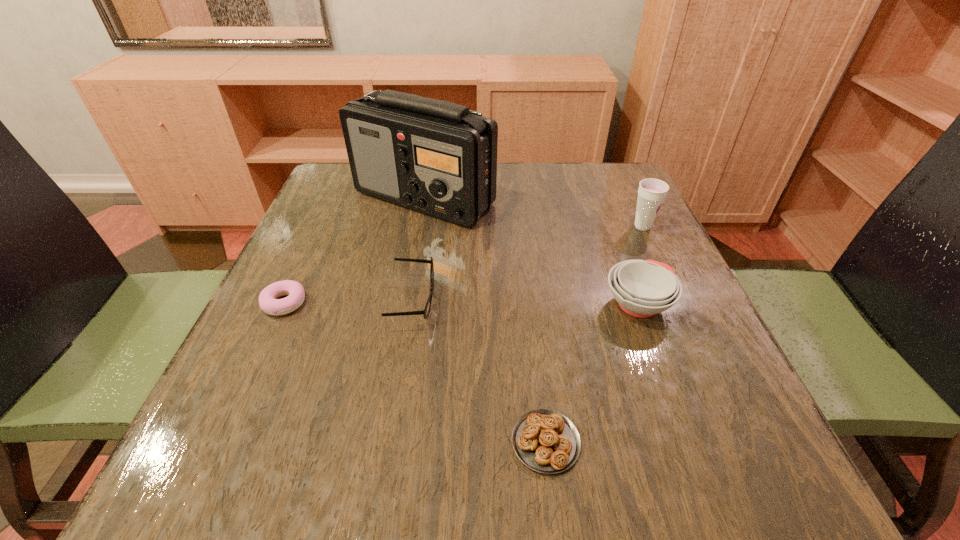
I want to click on object that is at the far left corner, so click(439, 158).

This screenshot has height=540, width=960. Identify the location of blank space at the near edge of the desktop. (332, 449).

In the image, there is a desktop. In order to click on vacant space at the left edge in this screenshot , I will do `click(246, 338)`.

At what (x,y) coordinates should I click in order to perform the action: click on free region at the right edge. Please return your answer as a coordinate pair (x, y). Image resolution: width=960 pixels, height=540 pixels. Looking at the image, I should click on (684, 286).

Locate an element on the screen. This screenshot has height=540, width=960. vacant region at the far left corner of the desktop is located at coordinates (326, 178).

This screenshot has height=540, width=960. What are the coordinates of `blank space at the far right corner of the desktop` in the screenshot? It's located at (590, 165).

Find the location of a particular element. vacant space at the near right corner of the desktop is located at coordinates (671, 502).

In order to click on free space that is in between the nearest object and the spectacles in this screenshot , I will do 480,372.

Where is `vacant space that's between the left pastry and the cup`? vacant space that's between the left pastry and the cup is located at coordinates (464, 265).

You are a GUI agent. You are given a task and a screenshot of the screen. Output one action in this format:
    pyautogui.click(x=<x>, y=<y>)
    Task: Click on the free space between the second tallest object and the tallest object
    This screenshot has width=960, height=540.
    Given the screenshot: What is the action you would take?
    pyautogui.click(x=534, y=212)